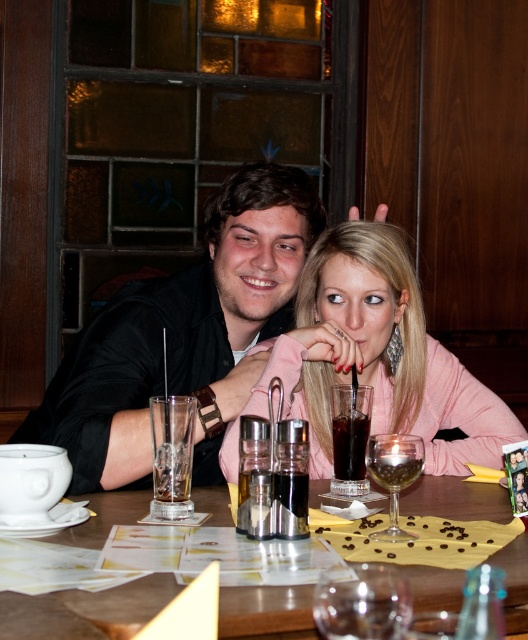
Question: Does transparent glass wine glass at center appear on the left side of dark brown glass at center?

Choices:
 (A) yes
 (B) no

Answer: (A)

Question: Which point is closer to the camera taking this photo?

Choices:
 (A) (293, 588)
 (B) (352, 416)
 (C) (89, 461)

Answer: (A)

Question: Observing the image, what is the correct spatial positioning of transparent glass wine glass at center in reference to clear glass wine at center?

Choices:
 (A) below
 (B) above

Answer: (A)

Question: Which object is positioned farthest from the clear glass wine at center?

Choices:
 (A) matte black shirt at center
 (B) transparent glass wine glass at center

Answer: (A)

Question: Which point is closer to the camera?

Choices:
 (A) (408, 472)
 (B) (284, 212)

Answer: (A)

Question: Does translucent glass table at center come in front of clear glass wine at center?

Choices:
 (A) no
 (B) yes

Answer: (B)